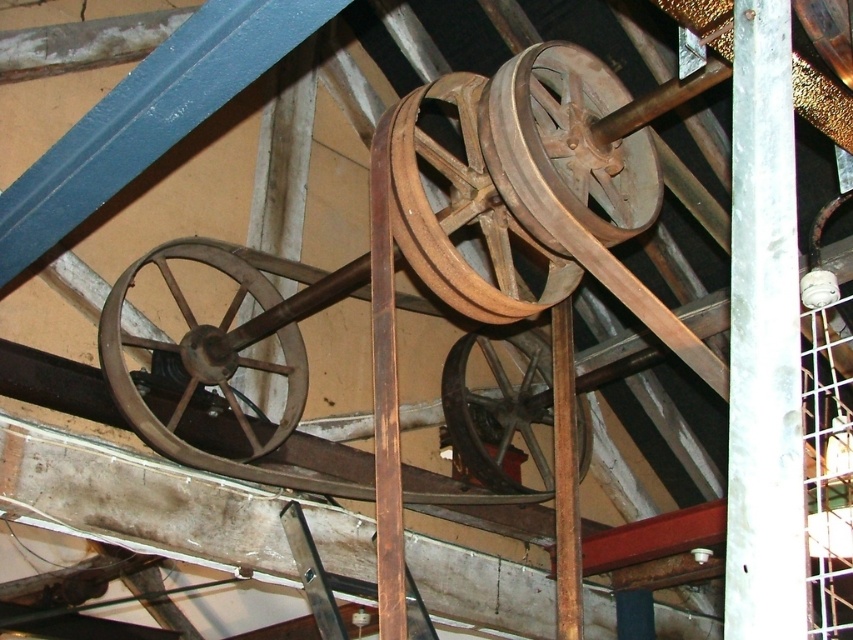
You are an engineer inspecting the mechanical setup. You need to locate the wooden wheel at left. Where is it positioned in the coordinate system of the image?

The wooden wheel at left is positioned at coordinates point [201,355].

You are an engineer inspecting the mechanical setup. You notice the rustic wood wheel at center and the wooden pulley at center. Based on their positions, which one is located to the right side of the other?

The rustic wood wheel at center is to the right of the wooden pulley at center, so the rustic wood wheel at center is located to the right of the wooden pulley at center.